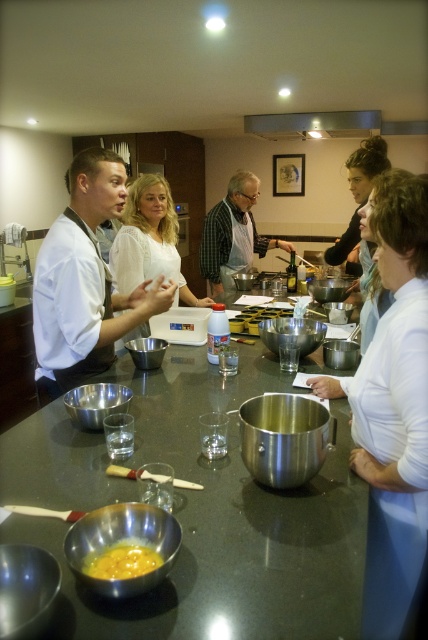
Between white glossy chef coat at center and yellow/yellowish-orange/egg at center, which one has more height?

With more height is white glossy chef coat at center.

Who is lower down, white glossy chef coat at center or yellow/yellowish-orange/egg at center?

yellow/yellowish-orange/egg at center is lower down.

I want to click on white glossy chef coat at center, so click(86, 280).

Is matte black apron at center behind yellow/yellowish-orange/egg at center?

Yes, matte black apron at center is behind yellow/yellowish-orange/egg at center.

Which is in front, point (214, 241) or point (115, 557)?

Point (115, 557) is in front.

Who is more forward, (207,221) or (88,563)?

Point (88,563) is in front.

Locate an element on the screen. The width and height of the screenshot is (428, 640). matte black apron at center is located at coordinates (232, 234).

Based on the photo, does shiny metallic table at center have a greater width compared to stainless steel exhaust hood at upper center?

In fact, shiny metallic table at center might be narrower than stainless steel exhaust hood at upper center.

This screenshot has width=428, height=640. I want to click on shiny metallic table at center, so click(225, 524).